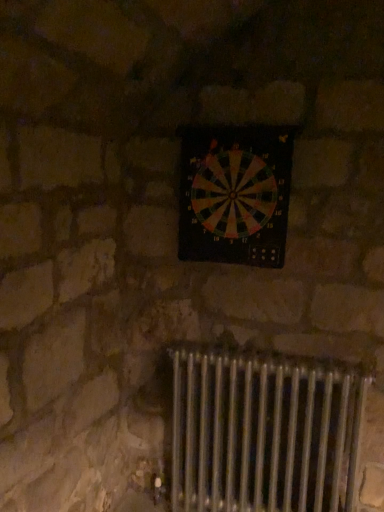
This screenshot has width=384, height=512. What are the coordinates of `free spot above multicolored plastic dartboard at center (from a real-world perspective)` in the screenshot? It's located at (242, 124).